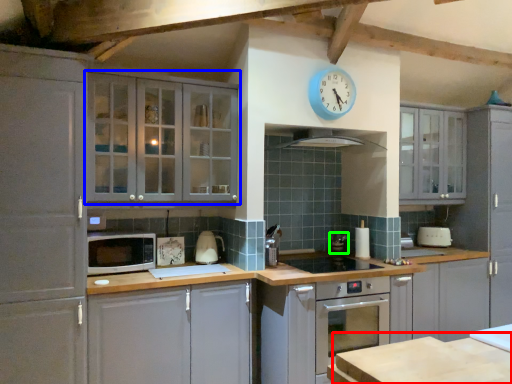
Question: Which object is the closest to the table (highlighted by a red box)? Choose among these: cabinetry (highlighted by a blue box) or appliance (highlighted by a green box).

Choices:
 (A) cabinetry
 (B) appliance

Answer: (A)